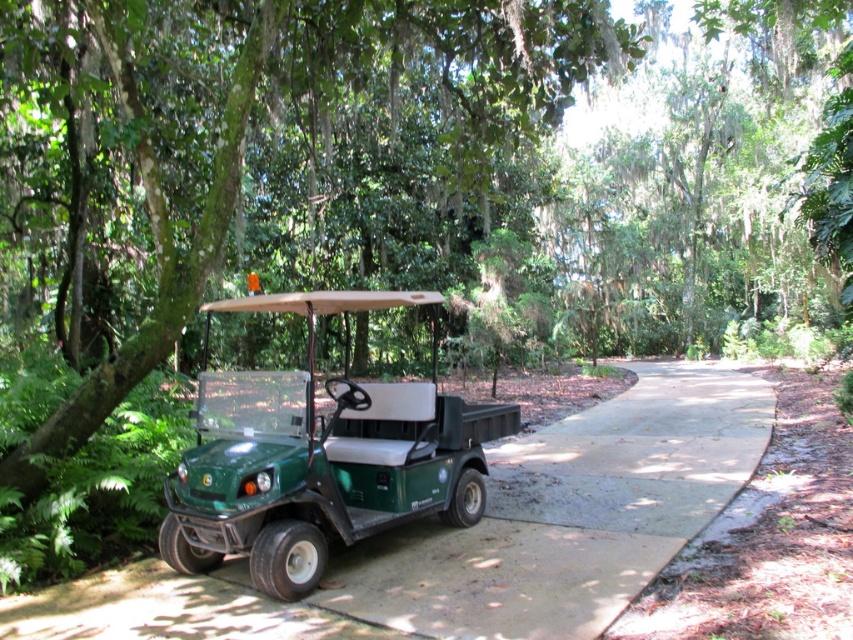
You are a maintenance worker needing to drive the green matte golf cart at center along the green rubber pavement at center. Can the golf cart fit on the pavement?

The green rubber pavement at center is wider than the green matte golf cart at center, so yes, the golf cart can fit on the pavement.